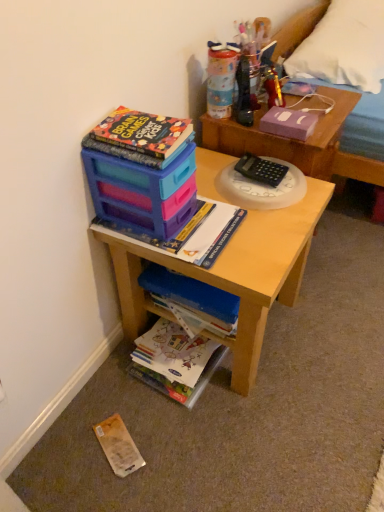
You are a GUI agent. You are given a task and a screenshot of the screen. Output one action in this format:
    pyautogui.click(x=<x>, y=<y>)
    Task: Click on the metallic gold toy at upper right
    
    Given the screenshot: What is the action you would take?
    pyautogui.click(x=272, y=86)

This screenshot has height=512, width=384. What do you see at coordinates (288, 123) in the screenshot? I see `purple matte paper at upper right, positioned as the first paperback book in right-to-left order` at bounding box center [288, 123].

Where is `white fabric pillow at upper right`? white fabric pillow at upper right is located at coordinates (344, 46).

What do you see at coordinates (192, 301) in the screenshot? The width and height of the screenshot is (384, 512). I see `blue matte book at center, the second book ordered from the bottom` at bounding box center [192, 301].

What do you see at coordinates (187, 233) in the screenshot? I see `matte plastic stack at upper center, arranged as the 3th book when ordered from the bottom` at bounding box center [187, 233].

Image resolution: width=384 pixels, height=512 pixels. What are the coordinates of `metallic gold toy at upper right` in the screenshot? It's located at (272, 86).

Which is more to the right, white fabric pillow at upper right or matte plastic desk at center?

Positioned to the right is white fabric pillow at upper right.

Can you tell me how much white fabric pillow at upper right and matte plastic desk at center differ in facing direction?

The angular difference between white fabric pillow at upper right and matte plastic desk at center is 0.00873 degrees.

Is white fabric pillow at upper right facing towards matte plastic desk at center?

No, white fabric pillow at upper right is not facing towards matte plastic desk at center.

Which object is wider, white fabric pillow at upper right or matte plastic desk at center?

matte plastic desk at center is wider.

Where is `stationery that is the 1st one above the matte plastic stack at upper center, which is the 2th book from top to bottom (from a real-world perspective)`? The height and width of the screenshot is (512, 384). stationery that is the 1st one above the matte plastic stack at upper center, which is the 2th book from top to bottom (from a real-world perspective) is located at coordinates (261, 170).

Who is smaller, matte plastic stack at upper center, arranged as the 3th book when ordered from the bottom, or black plastic calculator at center, the 1th stationery ordered from the bottom?

black plastic calculator at center, the 1th stationery ordered from the bottom.

What's the angular difference between matte plastic stack at upper center, arranged as the 3th book when ordered from the bottom, and black plastic calculator at center, the second stationery when ordered from top to bottom,'s facing directions?

They differ by 2.25 degrees in their facing directions.

Considering the points (116, 236) and (251, 158), which point is in front, point (116, 236) or point (251, 158)?

Positioned in front is point (116, 236).

Is metallic gold toy at upper right far from colored paper art at lower center, marked as the fourth book in a top-to-bottom arrangement?

metallic gold toy at upper right is actually quite close to colored paper art at lower center, marked as the fourth book in a top-to-bottom arrangement.

Does point (278, 102) come closer to viewer compared to point (156, 377)?

No.

From a real-world perspective, who is located lower, metallic gold toy at upper right or colored paper art at lower center, arranged as the 1th book when ordered from the bottom?

In real-world perspective, colored paper art at lower center, arranged as the 1th book when ordered from the bottom, is lower.

Considering the relative sizes of matte plastic desk at center and matte plastic water bottle at upper right, which appears as the 2th stationery when ordered from the bottom, in the image provided, is matte plastic desk at center bigger than matte plastic water bottle at upper right, which appears as the 2th stationery when ordered from the bottom,?

Yes.

Between matte plastic desk at center and matte plastic water bottle at upper right, positioned as the first stationery in top-to-bottom order, which one has more height?

Standing taller between the two is matte plastic desk at center.

Could you tell me if matte plastic desk at center is turned towards matte plastic water bottle at upper right, which appears as the 2th stationery when ordered from the bottom?

No, matte plastic desk at center is not facing towards matte plastic water bottle at upper right, which appears as the 2th stationery when ordered from the bottom.

From a real-world perspective, relative to matte plastic water bottle at upper right, which appears as the 2th stationery when ordered from the bottom, is matte plastic desk at center vertically above or below?

Clearly, from a real-world perspective, matte plastic desk at center is below matte plastic water bottle at upper right, which appears as the 2th stationery when ordered from the bottom.

How different are the orientations of metallic gold toy at upper right and white fabric pillow at upper right in degrees?

They differ by 0.217 degrees in their facing directions.

I want to click on toy that is in front of the white fabric pillow at upper right, so click(272, 86).

Which object is wider, metallic gold toy at upper right or white fabric pillow at upper right?

white fabric pillow at upper right.

In the scene shown: Based on their positions, is metallic gold toy at upper right located to the left or right of white fabric pillow at upper right?

metallic gold toy at upper right is to the left of white fabric pillow at upper right.

From a real-world perspective, is matte plastic stack at upper center, which is the 2th book from top to bottom, under plastic storage box at upper left?

Yes, from a real-world perspective, matte plastic stack at upper center, which is the 2th book from top to bottom, is under plastic storage box at upper left.

Is matte plastic stack at upper center, which is the 2th book from top to bottom, taller or shorter than plastic storage box at upper left?

In the image, matte plastic stack at upper center, which is the 2th book from top to bottom, appears to be shorter than plastic storage box at upper left.

Is matte plastic stack at upper center, which is the 2th book from top to bottom, situated inside plastic storage box at upper left or outside?

matte plastic stack at upper center, which is the 2th book from top to bottom, is spatially situated outside plastic storage box at upper left.

Is matte plastic stack at upper center, arranged as the 3th book when ordered from the bottom, wider or thinner than plastic storage box at upper left?

Clearly, matte plastic stack at upper center, arranged as the 3th book when ordered from the bottom, has more width compared to plastic storage box at upper left.

Considering the sizes of objects colored paper art at lower center, arranged as the 1th book when ordered from the bottom, and hardcover book at upper left, the first book in the top-to-bottom sequence, in the image provided, who is bigger, colored paper art at lower center, arranged as the 1th book when ordered from the bottom, or hardcover book at upper left, the first book in the top-to-bottom sequence,?

colored paper art at lower center, arranged as the 1th book when ordered from the bottom.

Relative to hardcover book at upper left, the 4th book from the bottom, is colored paper art at lower center, marked as the fourth book in a top-to-bottom arrangement, in front or behind?

In the image, colored paper art at lower center, marked as the fourth book in a top-to-bottom arrangement, appears behind hardcover book at upper left, the 4th book from the bottom.

From the image's perspective, does colored paper art at lower center, marked as the fourth book in a top-to-bottom arrangement, appear higher than hardcover book at upper left, the 4th book from the bottom?

No, from the image's perspective, colored paper art at lower center, marked as the fourth book in a top-to-bottom arrangement, is not on top of hardcover book at upper left, the 4th book from the bottom.

Find the location of a particular element. The height and width of the screenshot is (512, 384). pillow above the matte plastic desk at center (from the image's perspective) is located at coordinates (344, 46).

From a real-world perspective, count 1st stationerys upward from the matte plastic stack at upper center, arranged as the 3th book when ordered from the bottom, and point to it. Please provide its 2D coordinates.

[(261, 170)]

Estimate the real-world distances between objects in this image. Which object is further from hardcover book at upper left, the first book in the top-to-bottom sequence, metallic gold toy at upper right or wooden bed frame at upper right?

Among the two, wooden bed frame at upper right is located further to hardcover book at upper left, the first book in the top-to-bottom sequence.

Based on the photo, looking at the image, which one is located closer to matte plastic water bottle at upper right, which appears as the 2th stationery when ordered from the bottom, white fabric pillow at upper right or wooden bed frame at upper right?

wooden bed frame at upper right is positioned closer to the anchor matte plastic water bottle at upper right, which appears as the 2th stationery when ordered from the bottom.

Based on their spatial positions, is matte plastic water bottle at upper right, positioned as the first stationery in top-to-bottom order, or plastic storage box at upper left closer to purple matte paper at upper right, which is the 2th paperback book in bottom-to-top order?

Among the two, matte plastic water bottle at upper right, positioned as the first stationery in top-to-bottom order, is located nearer to purple matte paper at upper right, which is the 2th paperback book in bottom-to-top order.

In the scene shown: Based on their spatial positions, is yellow paper at lower left, arranged as the first paperback book when ordered from the bottom, or matte plastic water bottle at upper right, positioned as the first stationery in top-to-bottom order, further from plastic storage box at upper left?

yellow paper at lower left, arranged as the first paperback book when ordered from the bottom, lies further to plastic storage box at upper left than the other object.

Based on the photo, when comparing their distances from blue matte book at center, the second book ordered from the bottom, does matte plastic desk at center or black plastic calculator at center, the second stationery when ordered from top to bottom, seem further?

Among the two, black plastic calculator at center, the second stationery when ordered from top to bottom, is located further to blue matte book at center, the second book ordered from the bottom.

Considering their positions, is metallic gold toy at upper right positioned further to white fabric pillow at upper right than purple matte paper at upper right, which is the 2th paperback book in bottom-to-top order?

purple matte paper at upper right, which is the 2th paperback book in bottom-to-top order, is further to white fabric pillow at upper right.

From the image, which object appears to be farther from metallic gold toy at upper right, yellow paper at lower left, arranged as the first paperback book when ordered from the bottom, or black plastic calculator at center, the 1th stationery ordered from the bottom?

Among the two, yellow paper at lower left, arranged as the first paperback book when ordered from the bottom, is located further to metallic gold toy at upper right.

Considering their positions, is hardcover book at upper left, the 4th book from the bottom, positioned further to black plastic calculator at center, the 1th stationery ordered from the bottom, than blue matte book at center, acting as the third book starting from the top?

Based on the image, blue matte book at center, acting as the third book starting from the top, appears to be further to black plastic calculator at center, the 1th stationery ordered from the bottom.

You are a GUI agent. You are given a task and a screenshot of the screen. Output one action in this format:
    pyautogui.click(x=<x>, y=<y>)
    Task: Click on the paperback book that lies between white fabric pillow at upper right and colored paper art at lower center, arranged as the 1th book when ordered from the bottom, from top to bottom
    This screenshot has height=512, width=384.
    Given the screenshot: What is the action you would take?
    tap(288, 123)

Identify the location of toy situated between plastic storage box at upper left and purple matte paper at upper right, positioned as the first paperback book in right-to-left order, from left to right. (272, 86).

Where is `desk between hardcover book at upper left, the first book in the top-to-bottom sequence, and yellow paper at lower left, which is the 2th paperback book in top-to-bottom order, in the up-down direction`? desk between hardcover book at upper left, the first book in the top-to-bottom sequence, and yellow paper at lower left, which is the 2th paperback book in top-to-bottom order, in the up-down direction is located at coordinates (232, 273).

In order to click on paperback book that lies between metallic gold toy at upper right and colored paper art at lower center, arranged as the 1th book when ordered from the bottom, from top to bottom in this screenshot , I will do `click(288, 123)`.